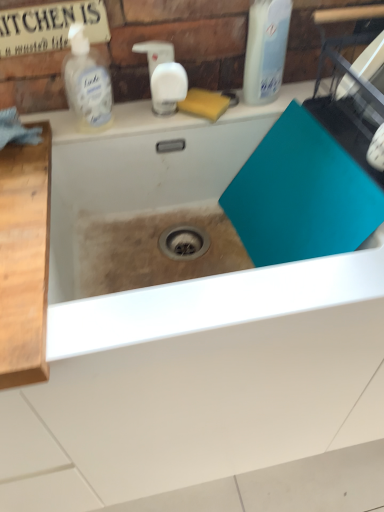
Question: Can you confirm if teal matte cutting board at center is positioned to the left of translucent plastic bottle at upper right, the second cleaning product from the left?

Choices:
 (A) no
 (B) yes

Answer: (B)

Question: Considering the relative sizes of teal matte cutting board at center and translucent plastic bottle at upper right, the second cleaning product from the left, in the image provided, is teal matte cutting board at center bigger than translucent plastic bottle at upper right, the second cleaning product from the left,?

Choices:
 (A) yes
 (B) no

Answer: (A)

Question: Is teal matte cutting board at center at the right side of translucent plastic bottle at upper right, the second cleaning product from the left?

Choices:
 (A) yes
 (B) no

Answer: (B)

Question: Can you confirm if teal matte cutting board at center is smaller than translucent plastic bottle at upper right, the second cleaning product from the left?

Choices:
 (A) no
 (B) yes

Answer: (A)

Question: Would you consider teal matte cutting board at center to be distant from translucent plastic bottle at upper right, the second cleaning product from the left?

Choices:
 (A) yes
 (B) no

Answer: (B)

Question: From the image's perspective, is translucent plastic bottle at upper right, which is the first cleaning product from right to left, above or below clear plastic bottle at upper left, positioned as the first cleaning product in left-to-right order?

Choices:
 (A) below
 (B) above

Answer: (B)

Question: Is translucent plastic bottle at upper right, which is the first cleaning product from right to left, inside or outside of clear plastic bottle at upper left, marked as the second cleaning product in a right-to-left arrangement?

Choices:
 (A) outside
 (B) inside

Answer: (A)

Question: In terms of size, does translucent plastic bottle at upper right, the second cleaning product from the left, appear bigger or smaller than clear plastic bottle at upper left, marked as the second cleaning product in a right-to-left arrangement?

Choices:
 (A) small
 (B) big

Answer: (B)

Question: Relative to clear plastic bottle at upper left, marked as the second cleaning product in a right-to-left arrangement, is translucent plastic bottle at upper right, which is the first cleaning product from right to left, in front or behind?

Choices:
 (A) behind
 (B) front

Answer: (B)

Question: Looking at their shapes, would you say clear plastic bottle at upper left, marked as the second cleaning product in a right-to-left arrangement, is wider or thinner than translucent plastic bottle at upper right, the second cleaning product from the left?

Choices:
 (A) thin
 (B) wide

Answer: (B)

Question: From the image's perspective, is clear plastic bottle at upper left, positioned as the first cleaning product in left-to-right order, positioned above or below translucent plastic bottle at upper right, which is the first cleaning product from right to left?

Choices:
 (A) below
 (B) above

Answer: (A)

Question: In terms of size, does clear plastic bottle at upper left, positioned as the first cleaning product in left-to-right order, appear bigger or smaller than translucent plastic bottle at upper right, the second cleaning product from the left?

Choices:
 (A) big
 (B) small

Answer: (B)

Question: Considering their positions, is clear plastic bottle at upper left, positioned as the first cleaning product in left-to-right order, located in front of or behind translucent plastic bottle at upper right, which is the first cleaning product from right to left?

Choices:
 (A) front
 (B) behind

Answer: (B)

Question: From the image's perspective, relative to clear plastic bottle at upper left, positioned as the first cleaning product in left-to-right order, is teal matte cutting board at center above or below?

Choices:
 (A) above
 (B) below

Answer: (B)

Question: Is point pyautogui.click(x=61, y=283) closer or farther from the camera than point pyautogui.click(x=79, y=96)?

Choices:
 (A) farther
 (B) closer

Answer: (B)